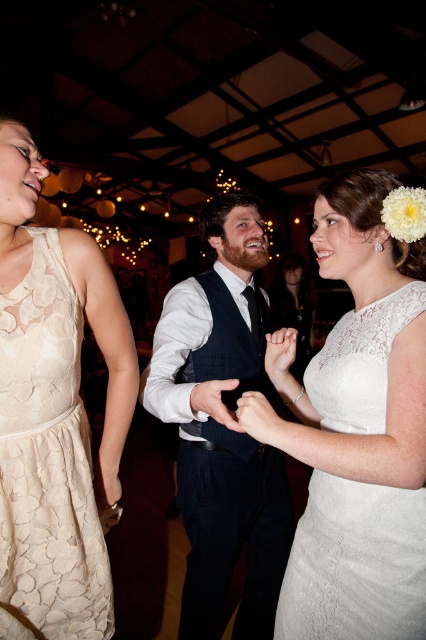
You are a photographer at the wedding reception. You want to take a photo of the dark blue textured vest at center and the white lace dress at center. Which one should you focus on to ensure the subject is in sharp focus?

You should focus on the dark blue textured vest at center because it is closer to the viewer than the white lace dress at center, so focusing on it will keep it sharp while the background may blur slightly.

You are a photographer at the wedding reception and want to capture a photo of the lace fabric dress at left. Where should you position your camera to ensure the dress is in the frame?

The lace fabric dress at left is located at point (x=48, y=464), so position the camera to focus on that coordinate for the best shot.

You are a photographer at the wedding reception and want to capture a photo of the lace fabric dress at left and the white lace dress at center. Which dress should you focus on first if you are moving from left to right across the scene?

You should focus on the lace fabric dress at left first because it is positioned to the left of the white lace dress at center.